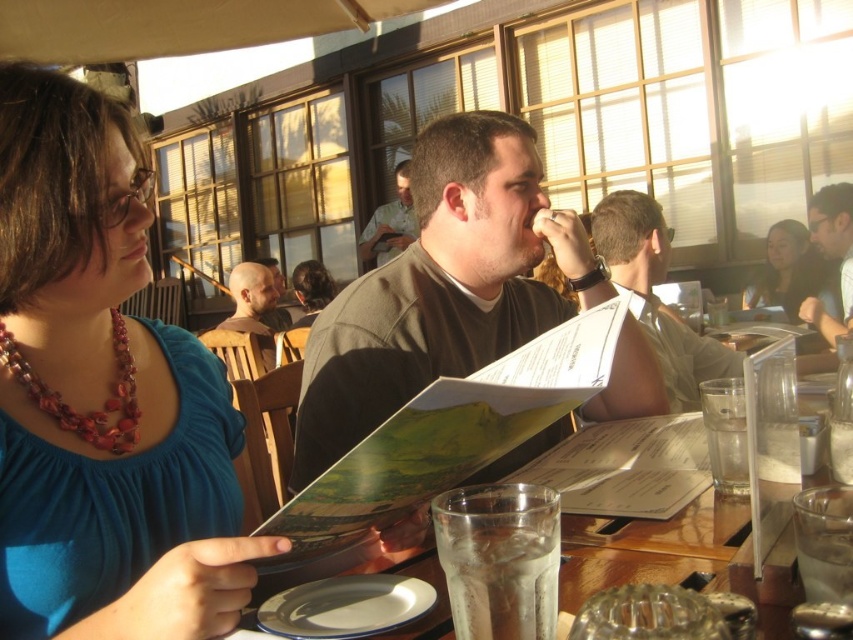
You are a customer at this outdoor restaurant and want to read the menu. Which object is easier to see between the white paper menu at center and the bald head at center?

The white paper menu at center is closer to the viewer than the bald head at center, so it is easier to see.

You are a server at the outdoor restaurant and need to deliver a drink to the customer. The drink needs to be placed on the table without obstructing the white paper menu at center or the bald head at center. Given that the menu is taller than the bald head, which object should you avoid placing the drink closer to?

Since the white paper menu at center is taller than the bald head at center, placing the drink closer to the white paper menu at center would be more likely to obstruct it. Therefore, the drink should be placed closer to the bald head at center to avoid obstruction.